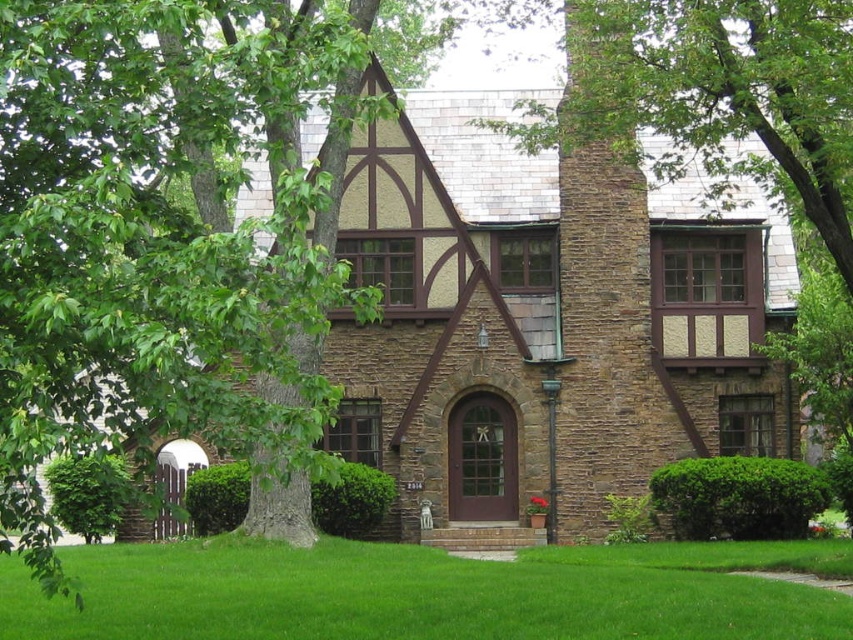
Can you confirm if green grass at lower center is shorter than brown stone chimney at upper right?

Indeed, green grass at lower center has a lesser height compared to brown stone chimney at upper right.

Does green grass at lower center appear on the left side of brown stone chimney at upper right?

Yes, green grass at lower center is to the left of brown stone chimney at upper right.

Does point (154, 557) come in front of point (592, 33)?

Yes.

Where is `green grass at lower center`? green grass at lower center is located at coordinates (430, 593).